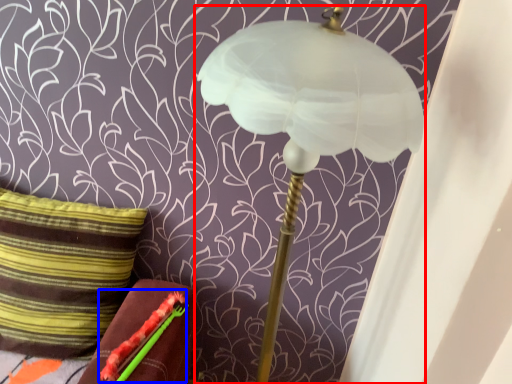
Question: Among these objects, which one is farthest to the camera, lamp (highlighted by a red box) or flower (highlighted by a blue box)?

Choices:
 (A) lamp
 (B) flower

Answer: (B)